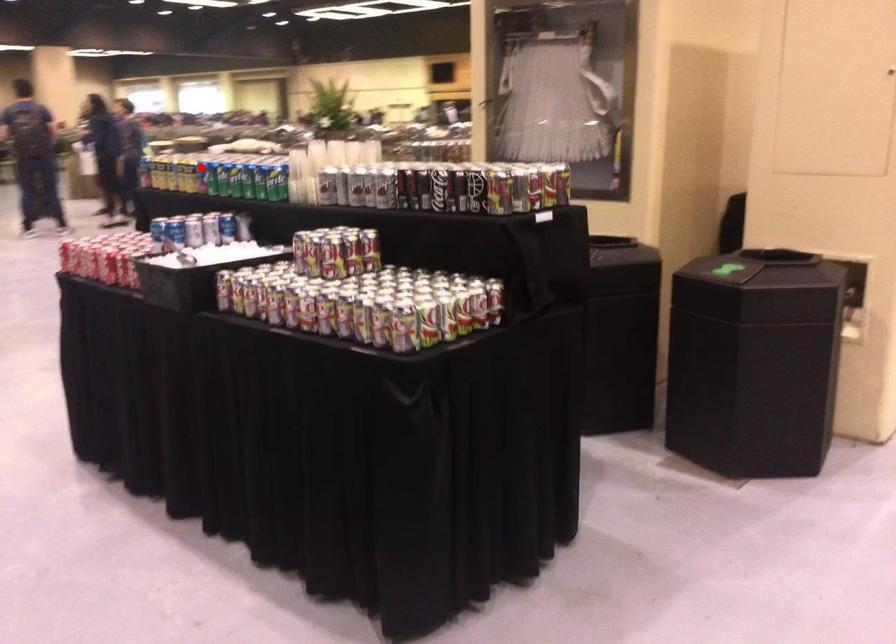
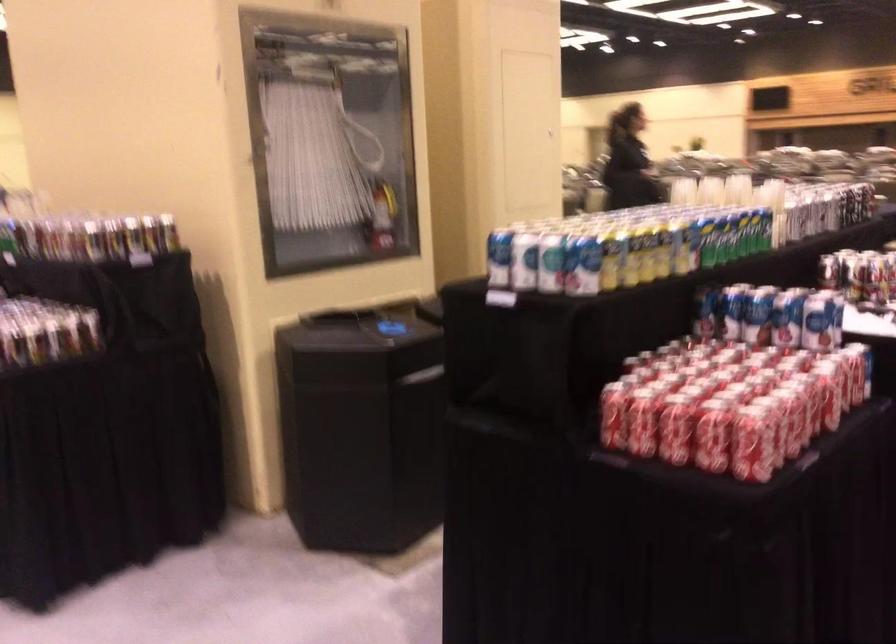
In the second image, find the point that corresponds to the highlighted location in the first image.

(703, 239)